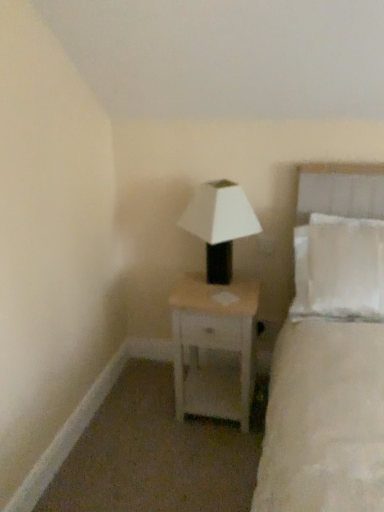
The image size is (384, 512). In order to click on free point below white matte lamp at center (from a real-world perspective) in this screenshot , I will do `click(218, 286)`.